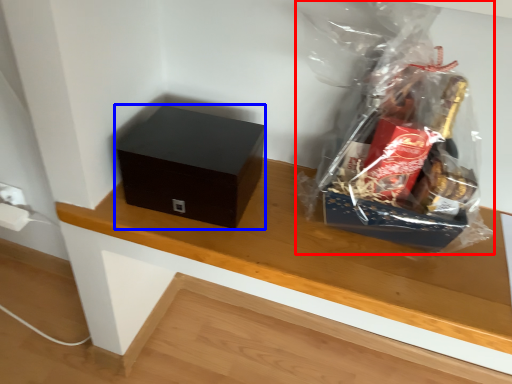
Question: Which of the following is the farthest to the observer, plastic bag (highlighted by a red box) or box (highlighted by a blue box)?

Choices:
 (A) plastic bag
 (B) box

Answer: (B)